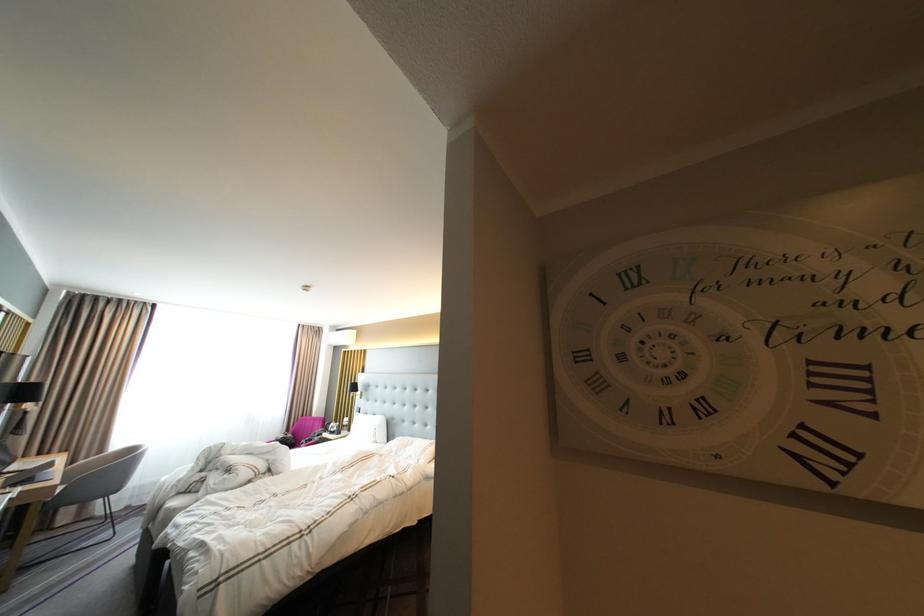
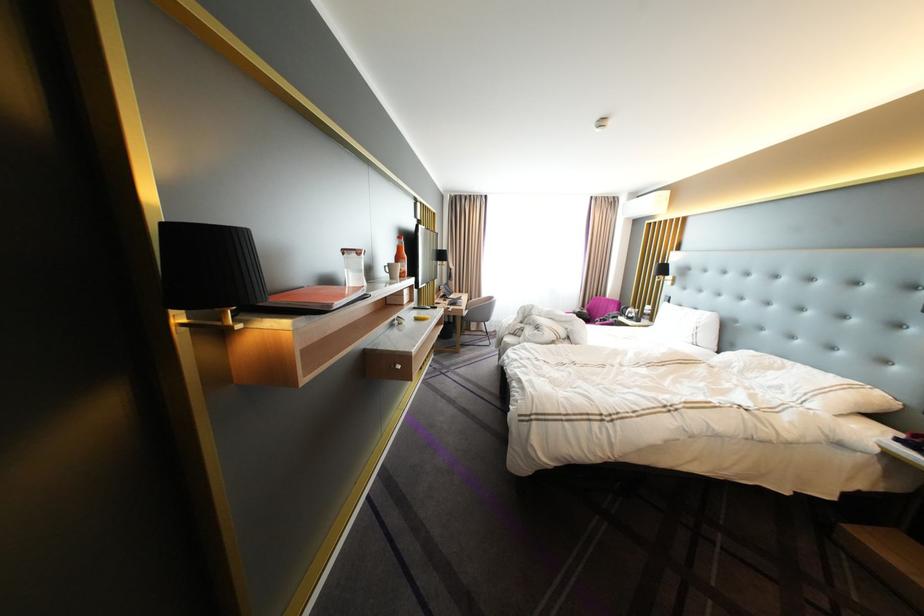
Locate, in the second image, the point that corresponds to pixel 114 451 in the first image.

(492, 296)